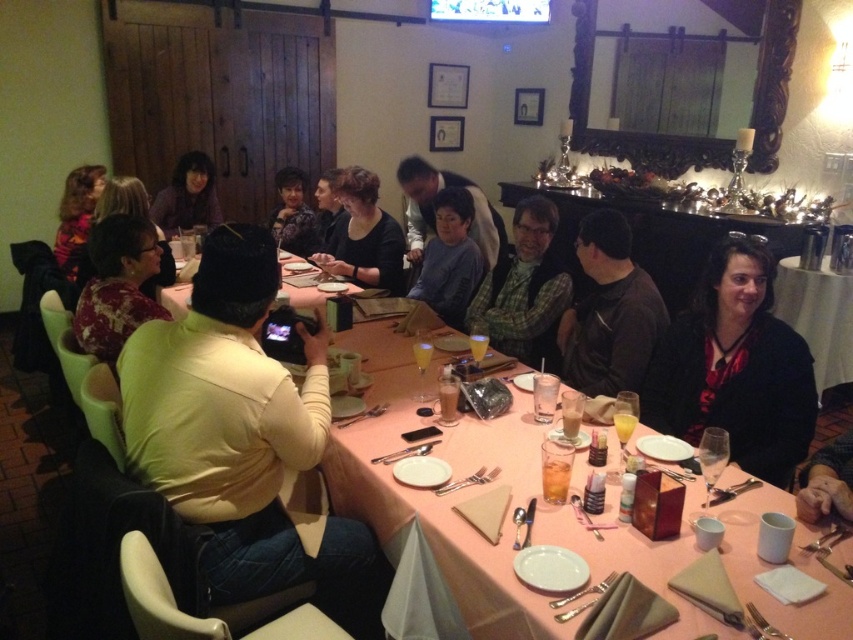
From the picture: You are a guest at this dinner party and want to retrieve your light brown leather jacket at center. You are currently standing next to the matte floral dress at center. Which direction should you move to reach your jacket?

The light brown leather jacket at center is located to the right of the matte floral dress at center, so you should move to your right to reach it.

You are a photographer at the dinner party and want to capture both the printed fabric blouse at left and the matte floral dress at center in a single shot. Which one should you focus on first to ensure both are in focus?

You should focus on the printed fabric blouse at left first because it is closer to the viewer than the matte floral dress at center, so adjusting focus from near to far will help both be in focus.

You are a guest at the dinner party and want to place your black matte jacket at lower right on the chair next to the pink fabric table at center. According to the scene, which side of the table should you place it on?

The pink fabric table at center is to the left of the black matte jacket at lower right, so you should place the black matte jacket at lower right on the right side of the table.